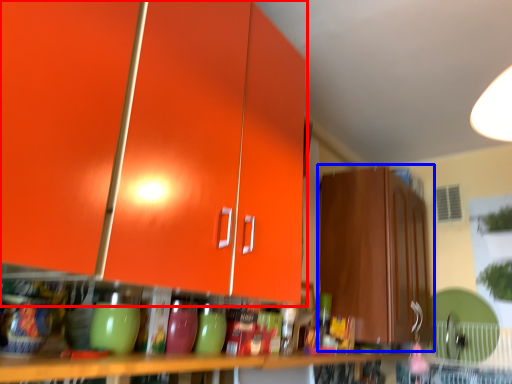
Question: Which object appears closest to the camera in this image, cabinetry (highlighted by a red box) or cabinetry (highlighted by a blue box)?

Choices:
 (A) cabinetry
 (B) cabinetry

Answer: (A)